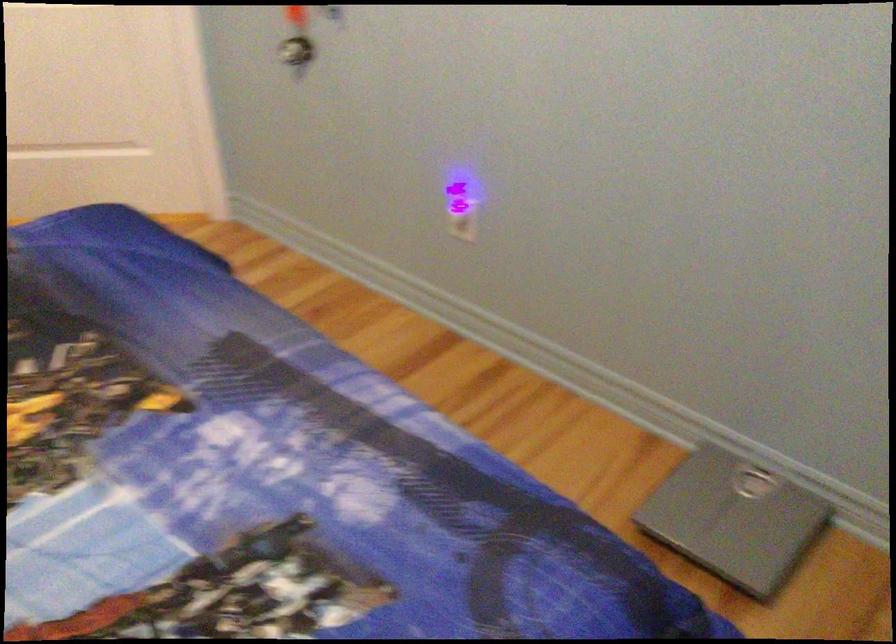
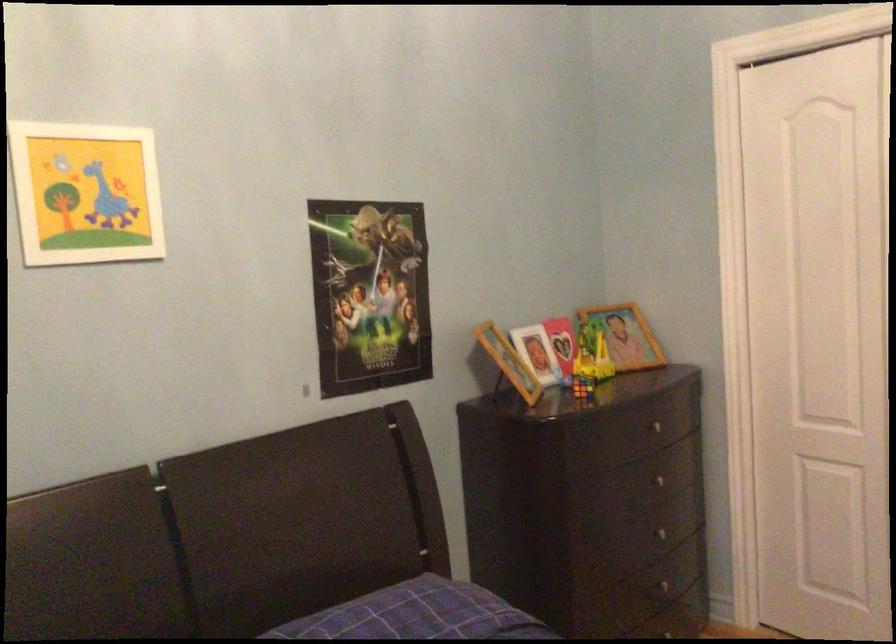
Question: How did the camera likely rotate?

Choices:
 (A) Left
 (B) Right
 (C) Up
 (D) Down

Answer: (A)